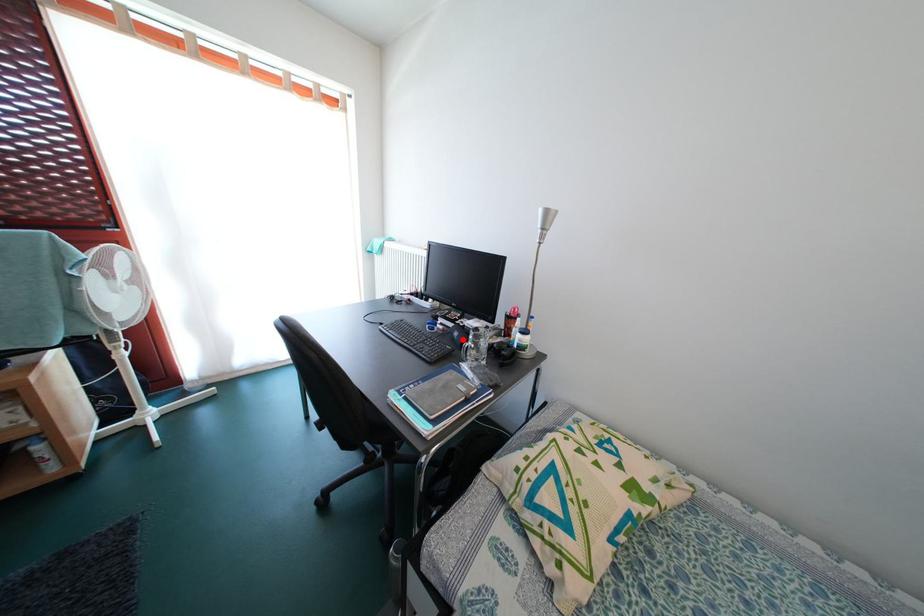
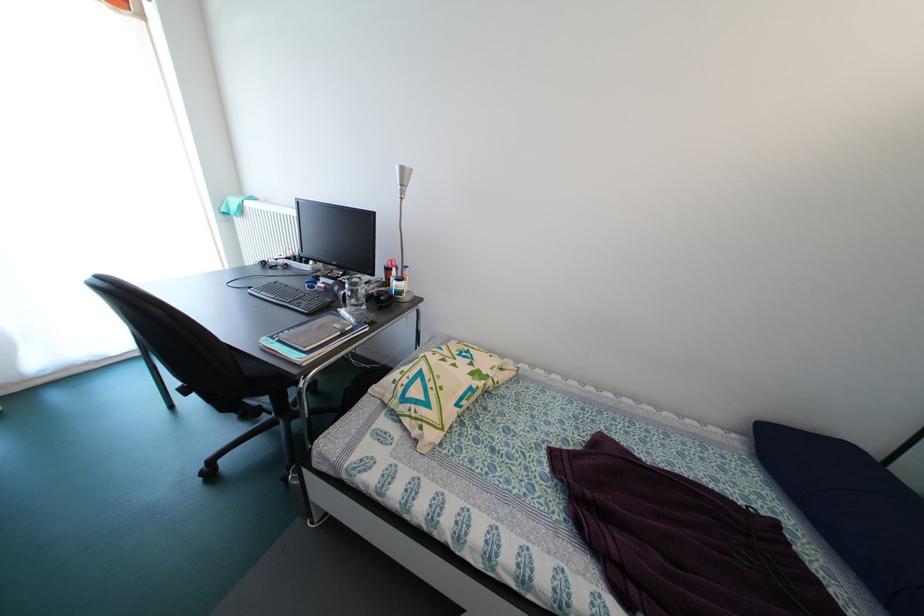
Where in the second image is the point corresponding to the highlighted location from the first image?

(344, 294)